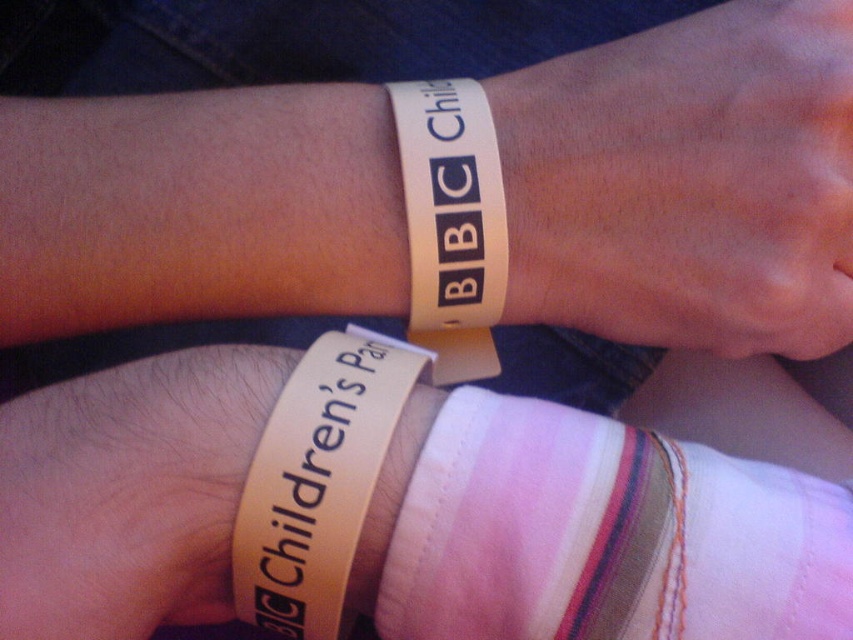
Question: Is tan rubber wristband at lower center thinner than white paper wristband at upper right?

Choices:
 (A) yes
 (B) no

Answer: (B)

Question: Among these points, which one is farthest from the camera?

Choices:
 (A) (508, 243)
 (B) (695, 196)
 (C) (366, 337)

Answer: (C)

Question: Estimate the real-world distances between objects in this image. Which object is closer to the white matte wristband at upper center?

Choices:
 (A) white paper wristband at upper right
 (B) tan rubber wristband at lower center

Answer: (A)

Question: Which object is the farthest from the white paper wristband at upper right?

Choices:
 (A) white matte wristband at upper center
 (B) tan rubber wristband at lower center

Answer: (B)

Question: Does white matte wristband at upper center appear on the right side of white paper wristband at upper right?

Choices:
 (A) no
 (B) yes

Answer: (B)

Question: Is white matte wristband at upper center thinner than tan rubber wristband at lower center?

Choices:
 (A) yes
 (B) no

Answer: (B)